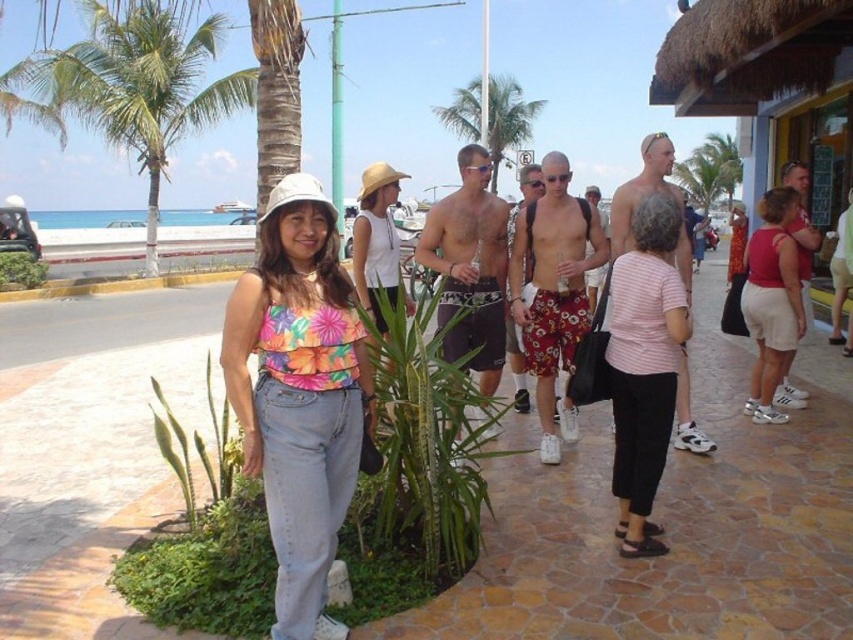
Describe the element at coordinates (299, 394) in the screenshot. The image size is (853, 640). I see `floral fabric top at center` at that location.

Who is more distant from viewer, [343,378] or [152,168]?

The point [152,168] is more distant.

This screenshot has height=640, width=853. What do you see at coordinates (299, 394) in the screenshot?
I see `floral fabric top at center` at bounding box center [299, 394].

Locate an element on the screen. floral fabric top at center is located at coordinates (299, 394).

Is dark gray swim trunks at center wider than green leafy palm tree at center?

No.

Is dark gray swim trunks at center below green leafy palm tree at center?

Yes.

Who is more forward, (485, 352) or (511, 122)?

Point (485, 352) is in front.

This screenshot has height=640, width=853. I want to click on dark gray swim trunks at center, so click(x=469, y=266).

Is pink striped shirt at center below green leafy plant at lower left?

Yes, pink striped shirt at center is below green leafy plant at lower left.

Can you confirm if pink striped shirt at center is smaller than green leafy plant at lower left?

Correct, pink striped shirt at center occupies less space than green leafy plant at lower left.

This screenshot has height=640, width=853. In order to click on pink striped shirt at center in this screenshot , I will do `click(643, 365)`.